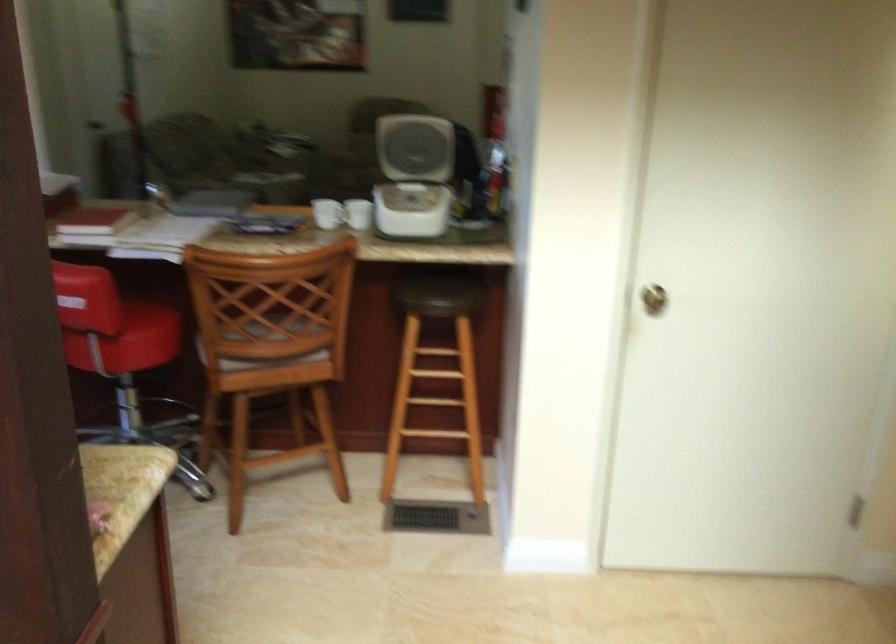
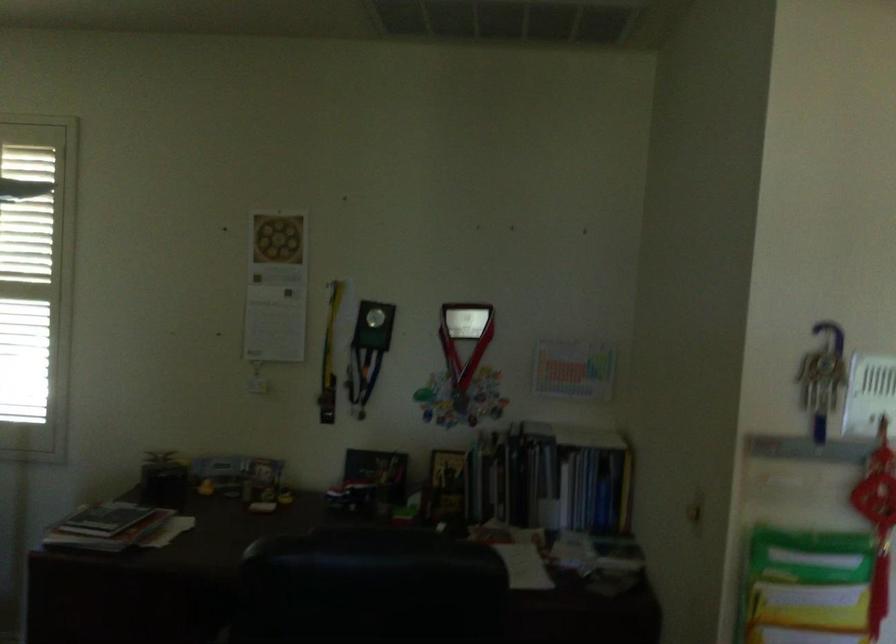
Locate, in the second image, the point that corresponds to (x=493, y=149) in the first image.

(814, 558)